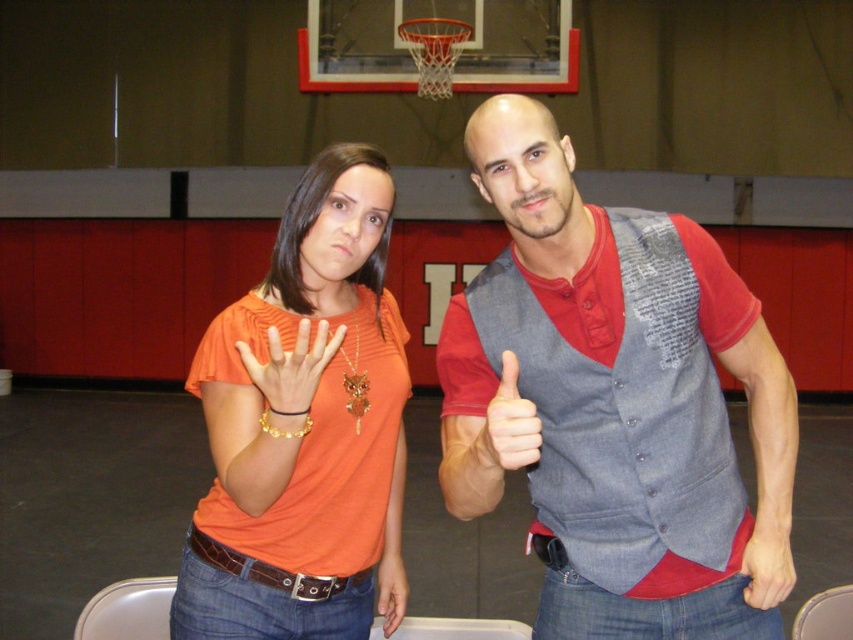
From the picture: You are a photographer who wants to capture a clear shot of both the matte gray hand at lower right and the gold metallic bracelet at center. However, you notice that one object is blocking the view of the other. Which object is being obscured and by what?

The gold metallic bracelet at center is being obscured by the matte gray hand at lower right because the bracelet is positioned behind the hand.

You are a photographer trying to capture a clear shot of the gold metallic bracelet at center and the orange fabric shirt at left. Which object is closer to the camera?

The orange fabric shirt at left is closer to the camera because the gold metallic bracelet at center is behind it.

In the scene shown: You are a photographer trying to capture a group photo. You notice two orange shirts in the frame. The orange fabric shirt at left and the matte orange shirt at center. Based on their positions, which one should you ask to move back so the other is more visible?

The orange fabric shirt at left is in front of the matte orange shirt at center, so you should ask the orange fabric shirt at left to move back so the matte orange shirt at center becomes more visible.